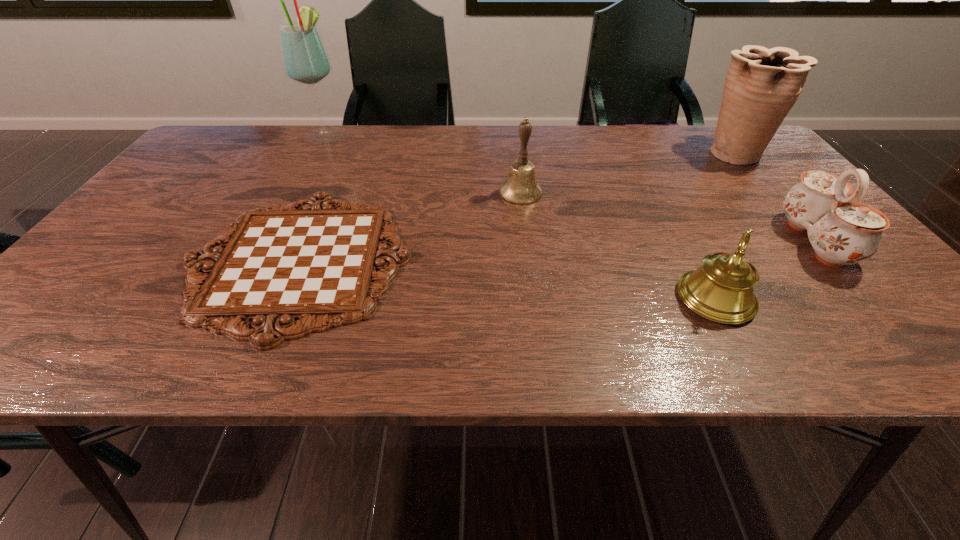
Identify the location of free area in between the chessboard and the third object from right to left. The width and height of the screenshot is (960, 540). (508, 279).

Find the location of `vacant region between the shorter bell and the second tallest object`. vacant region between the shorter bell and the second tallest object is located at coordinates (724, 225).

You are a GUI agent. You are given a task and a screenshot of the screen. Output one action in this format:
    pyautogui.click(x=<x>, y=<y>)
    Task: Click on the empty space that is in between the alcohol and the third object from right to left
    This screenshot has width=960, height=540.
    Given the screenshot: What is the action you would take?
    pyautogui.click(x=521, y=217)

This screenshot has height=540, width=960. In order to click on empty location between the right bell and the second tallest object in this screenshot , I will do `click(724, 225)`.

Where is `empty location between the chinaware and the chessboard`? empty location between the chinaware and the chessboard is located at coordinates (557, 251).

Where is `empty space between the farther bell and the nearer bell`? The width and height of the screenshot is (960, 540). empty space between the farther bell and the nearer bell is located at coordinates (618, 245).

At what (x,y) coordinates should I click in order to perform the action: click on unoccupied position between the nearer bell and the third object from left to right. Please return your answer as a coordinate pair (x, y). The image size is (960, 540). Looking at the image, I should click on (618, 245).

Identify which object is located as the fifth nearest to the chessboard. Please provide its 2D coordinates. Your answer should be formatted as a tuple, i.e. [(x, y)], where the tuple contains the x and y coordinates of a point satisfying the conditions above.

[(842, 231)]

The width and height of the screenshot is (960, 540). I want to click on object that is the fifth closest to the tallest object, so click(842, 231).